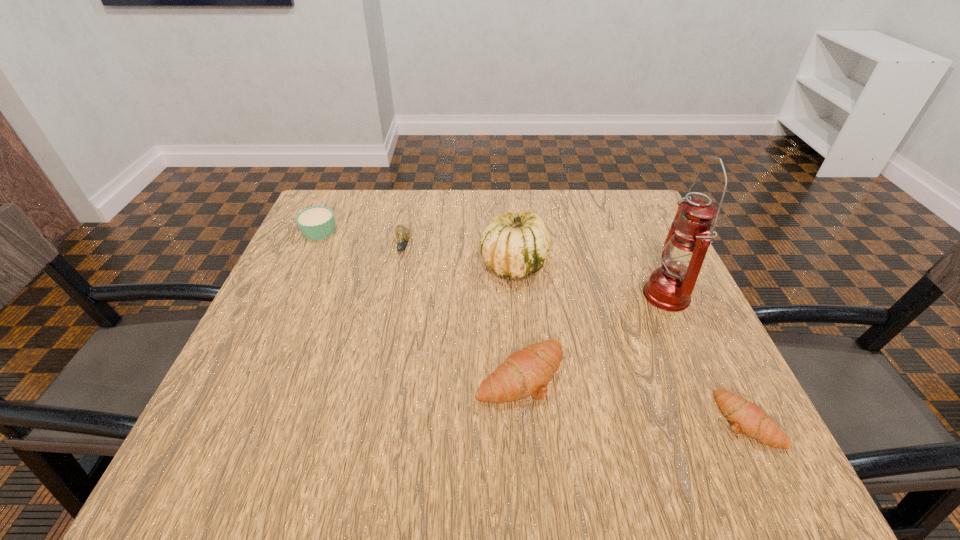
I want to click on blank area located on the front of the second tallest object, so click(524, 380).

Identify the location of free location located on the left of the tallest object. (611, 294).

Where is `vacant space situated 0.310m on the front-facing side of the escargot`? vacant space situated 0.310m on the front-facing side of the escargot is located at coordinates (377, 367).

You are a GUI agent. You are given a task and a screenshot of the screen. Output one action in this format:
    pyautogui.click(x=<x>, y=<y>)
    Task: Click on the cupcake positioned at the far edge
    This screenshot has width=960, height=540.
    Given the screenshot: What is the action you would take?
    pyautogui.click(x=317, y=222)

The image size is (960, 540). In order to click on escargot at the far edge in this screenshot , I will do `click(403, 233)`.

You are a GUI agent. You are given a task and a screenshot of the screen. Output one action in this format:
    pyautogui.click(x=<x>, y=<y>)
    Task: Click on the object at the left edge
    The image size is (960, 540).
    Given the screenshot: What is the action you would take?
    pyautogui.click(x=317, y=222)

This screenshot has height=540, width=960. What are the coordinates of `crescent roll that is at the right edge` in the screenshot? It's located at (745, 416).

This screenshot has height=540, width=960. In order to click on oil lamp present at the right edge in this screenshot , I will do `click(669, 288)`.

You are a GUI agent. You are given a task and a screenshot of the screen. Output one action in this format:
    pyautogui.click(x=<x>, y=<y>)
    Task: Click on the object located in the far left corner section of the desktop
    
    Given the screenshot: What is the action you would take?
    pyautogui.click(x=317, y=222)

Identify the location of object that is at the near right corner. The image size is (960, 540). [x=745, y=416].